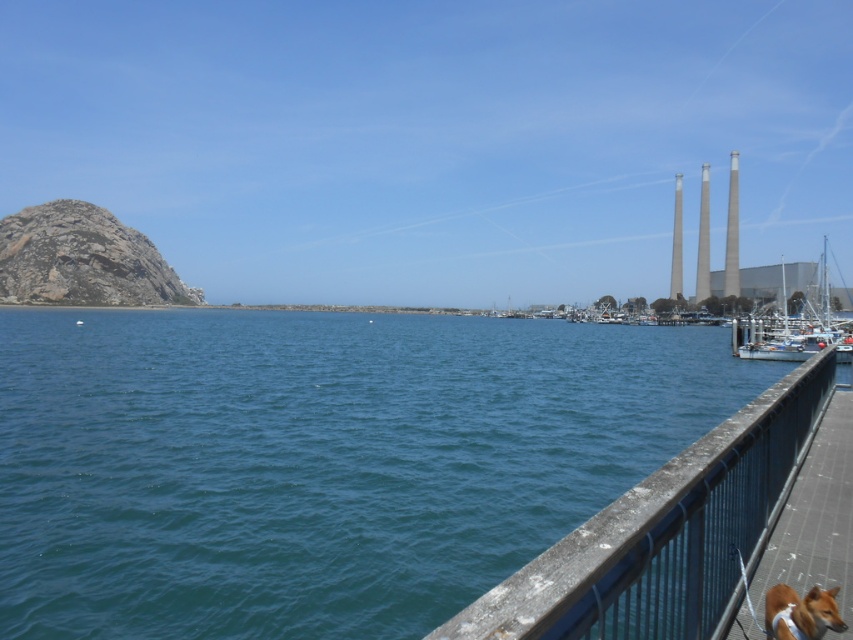
You are standing at the edge of the waterfront scene and want to take a photo of the blue water at center and the brown fur dog at lower right. Which object should you focus on first if you want to capture both in one shot without moving the camera?

The blue water at center is located above the brown fur dog at lower right, so you should focus on the brown fur dog at lower right first since it is closer to the camera and adjust the focus to include the blue water at center in the background.

You are standing on the smooth metal dock at lower right and want to board the white glossy boat at right. In which direction should you walk to reach the boat?

You should walk to the right because the white glossy boat at right is located to the right of the smooth metal dock at lower right.

You are standing on the smooth metal dock at lower right and want to look across to the blue water at center. Which one is higher in elevation?

The blue water at center is taller than the smooth metal dock at lower right, so the blue water at center is higher in elevation.